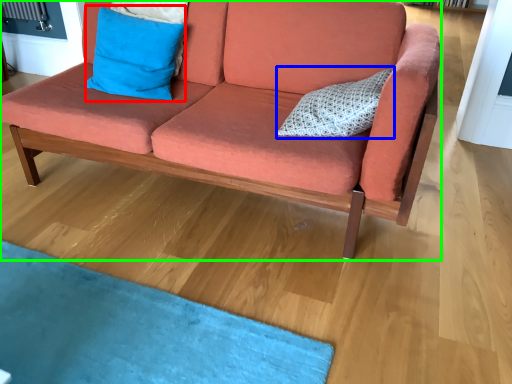
Question: Considering the real-world distances, which object is closest to pillow (highlighted by a red box)? pillow (highlighted by a blue box) or studio couch (highlighted by a green box).

Choices:
 (A) pillow
 (B) studio couch

Answer: (B)